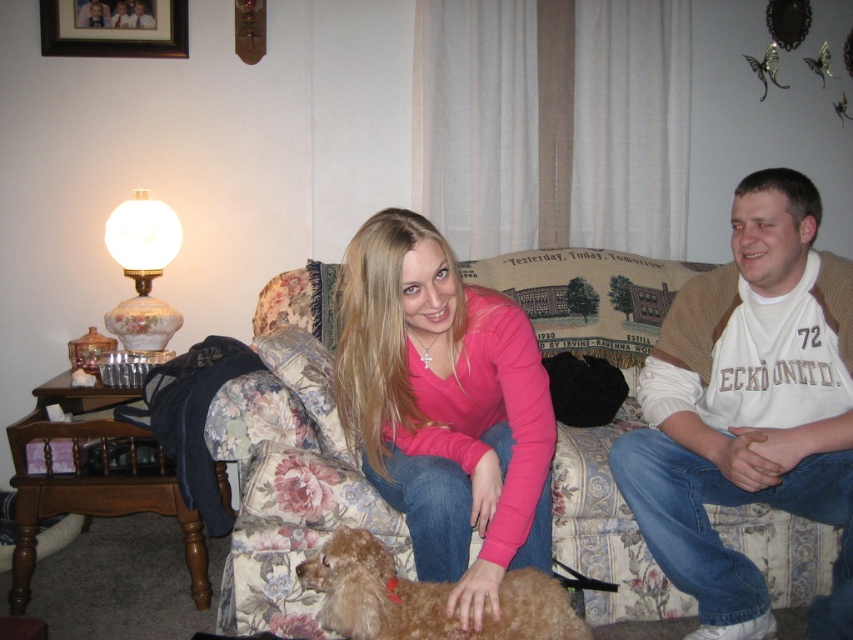
The image size is (853, 640). What do you see at coordinates (288, 465) in the screenshot?
I see `floral fabric couch at center` at bounding box center [288, 465].

Can you confirm if floral fabric couch at center is positioned to the left of brushed metal picture frame at upper left?

In fact, floral fabric couch at center is to the right of brushed metal picture frame at upper left.

Where is `floral fabric couch at center`? floral fabric couch at center is located at coordinates (288, 465).

Does pink matte sweater at center have a smaller size compared to brushed metal picture frame at upper left?

No.

The image size is (853, 640). Identify the location of pink matte sweater at center. (444, 406).

Which is in front, point (459, 570) or point (62, 1)?

Positioned in front is point (459, 570).

Find the location of `pink matte sweater at center`. pink matte sweater at center is located at coordinates (444, 406).

Does white cotton shirt at center lie behind matte pink sweater at center?

No.

Can you confirm if white cotton shirt at center is positioned to the right of matte pink sweater at center?

Yes, white cotton shirt at center is to the right of matte pink sweater at center.

Does point (711, 580) lie in front of point (144, 19)?

That is True.

Locate an element on the screen. This screenshot has height=640, width=853. white cotton shirt at center is located at coordinates (747, 410).